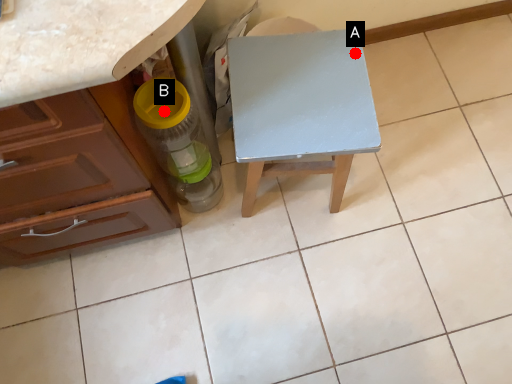
Question: Two points are circled on the image, labeled by A and B beside each circle. Which of the following is the farthest from the observer?

Choices:
 (A) A is further
 (B) B is further

Answer: (A)